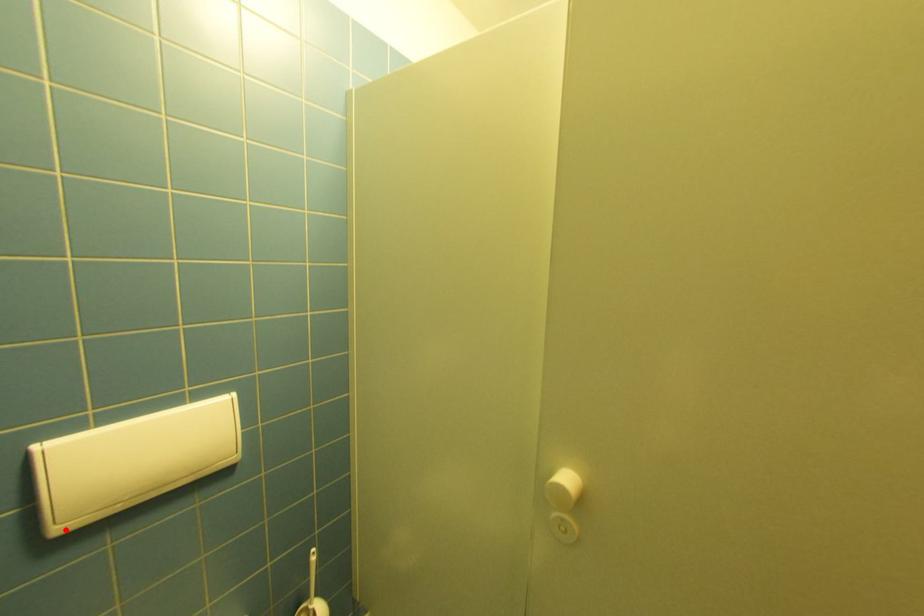
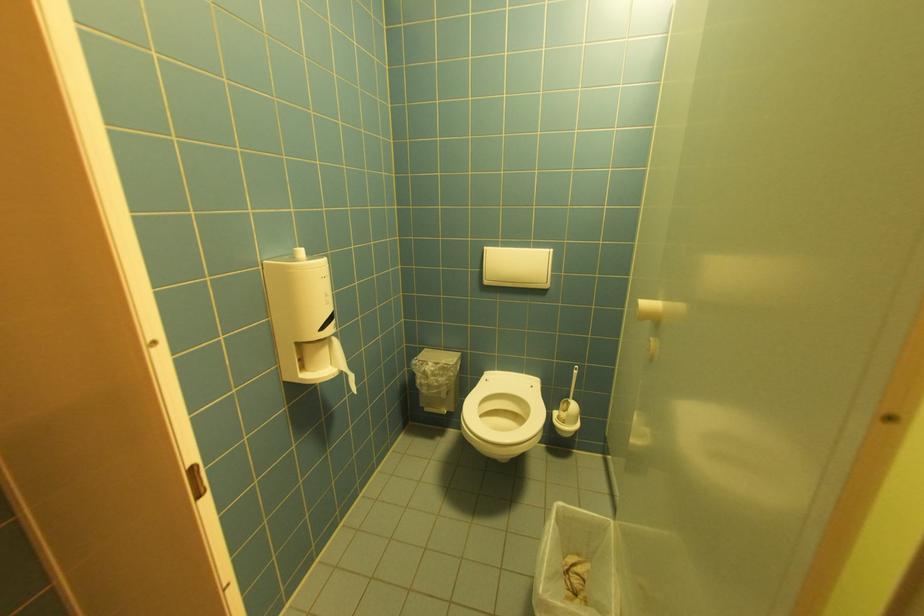
Locate, in the second image, the point that corresponds to the highlighted location in the first image.

(492, 283)